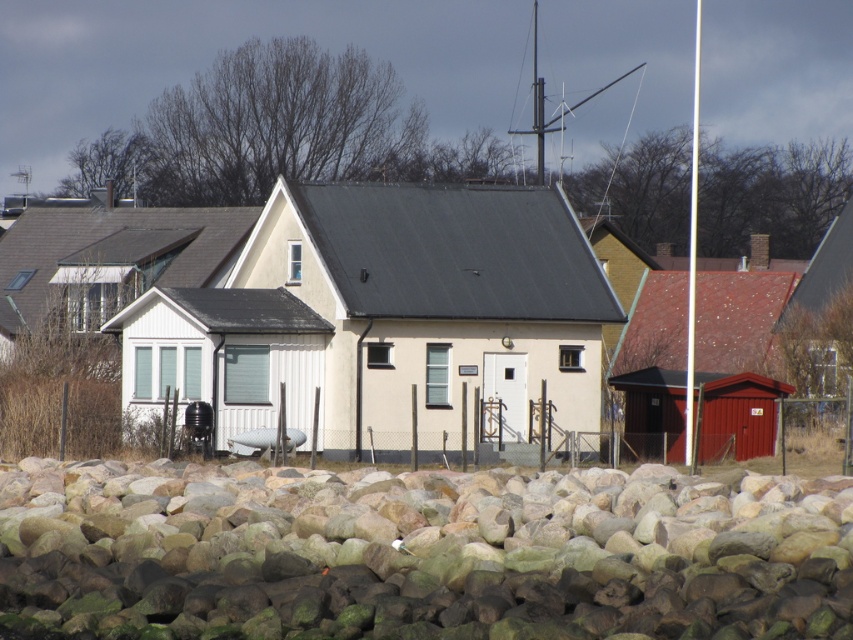
You are standing at the center of the house and want to place a new decorative item exactly at the location of the smooth gray rock at lower center. What are the coordinates where you should place it?

The coordinates for the smooth gray rock at lower center are at point (431,557).

You are standing at the point marked by the coordinate point at (x=373, y=420) and want to walk to the house. The distance between the point and the house is 42.29 meters. If your walking speed is 1.5 meters per second, how many seconds will it take you to reach the house?

The distance between the point and the house is 42.29 meters. At a speed of 1.5 meters per second, it will take approximately 28.19 seconds to reach the house.